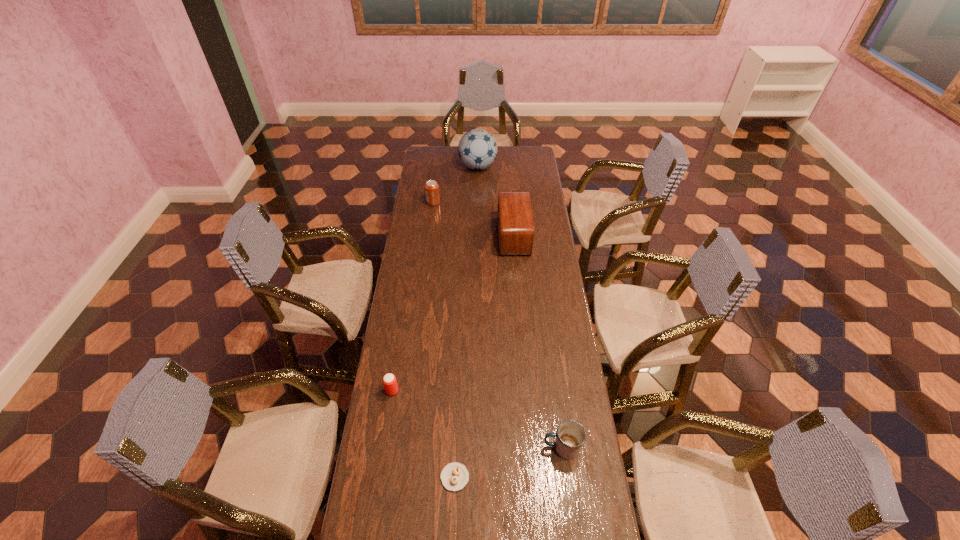
This screenshot has width=960, height=540. I want to click on cupcake, so click(x=454, y=476).

At what (x,y) coordinates should I click in order to perform the action: click on the shortest object. Please return your answer as a coordinate pair (x, y). This screenshot has height=540, width=960. Looking at the image, I should click on (454, 476).

Locate an element on the screen. vacant area situated on the side with brand of the tallest object is located at coordinates (527, 167).

The width and height of the screenshot is (960, 540). Find the location of `free location located 0.240m on the front panel of the second tallest object`. free location located 0.240m on the front panel of the second tallest object is located at coordinates (451, 236).

Where is `vacant space located on the front panel of the second tallest object`? vacant space located on the front panel of the second tallest object is located at coordinates (485, 236).

Identify the location of vacant space situated on the front panel of the second tallest object. (445, 236).

What are the coordinates of `free region located on the right of the fifth object from right to left` in the screenshot? It's located at (490, 202).

The height and width of the screenshot is (540, 960). I want to click on vacant space situated 0.320m on the handle side of the mug, so click(448, 448).

What are the coordinates of `vacant space situated on the handle side of the mug` in the screenshot? It's located at pyautogui.click(x=528, y=448).

Identify the location of vacant space situated 0.170m on the handle side of the mug. This screenshot has height=540, width=960. (492, 448).